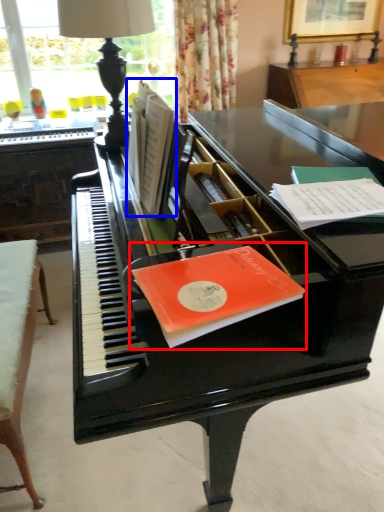
Question: Among these objects, which one is nearest to the camera, paperback book (highlighted by a red box) or book (highlighted by a blue box)?

Choices:
 (A) paperback book
 (B) book

Answer: (A)